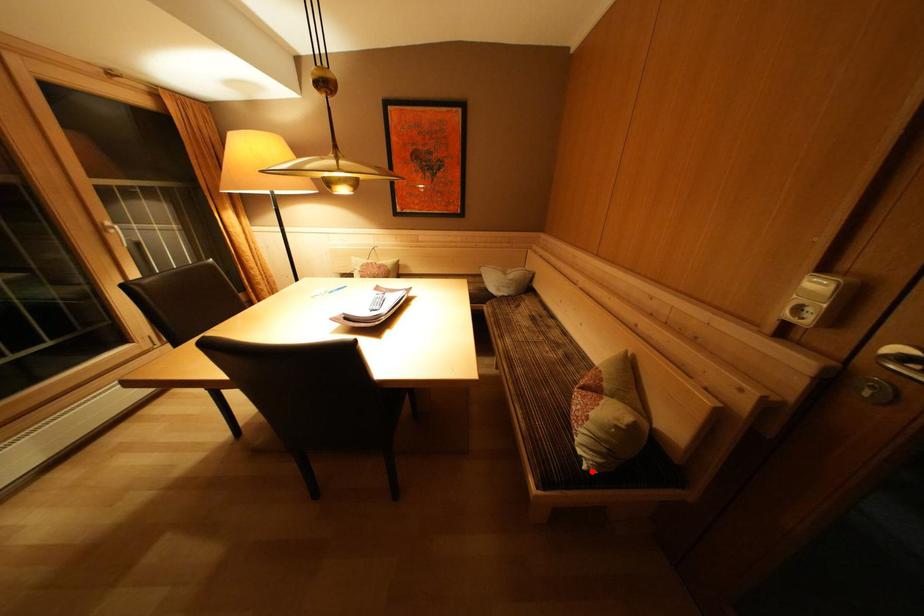
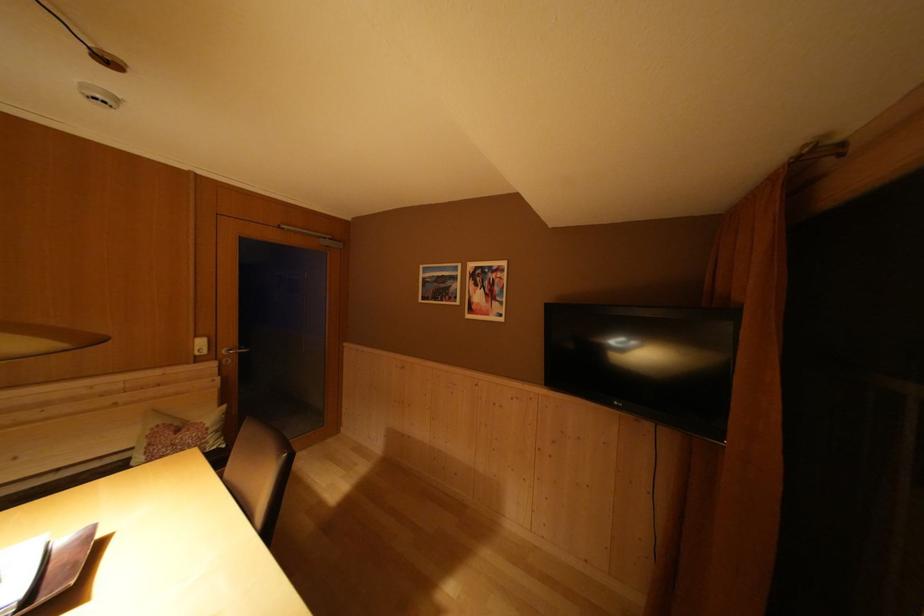
Question: A red point is marked in image1. In image2, is the corresponding 3D point closer to the camera or farther? Reply with the corresponding letter.

Choices:
 (A) The corresponding 3D point is closer.
 (B) The corresponding 3D point is farther.

Answer: (B)